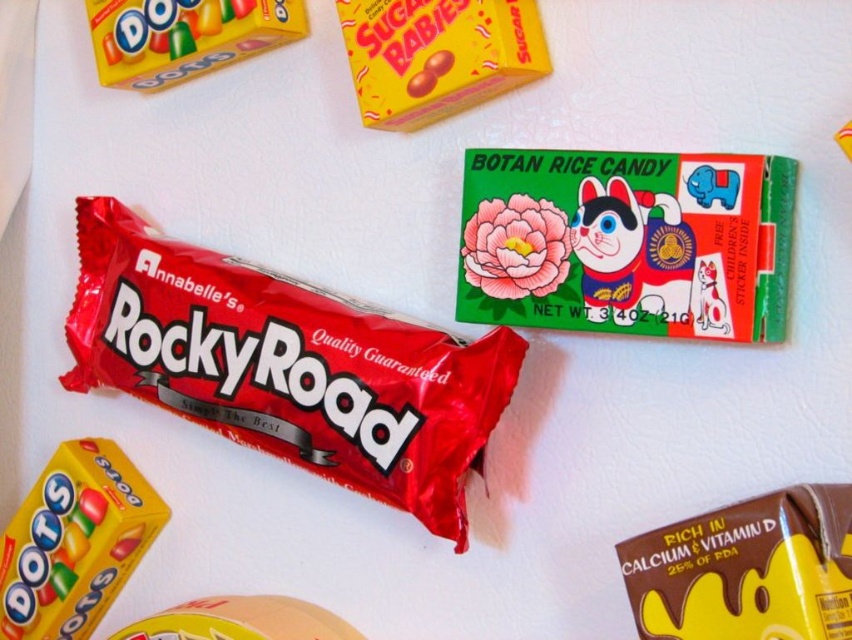
Question: Can you confirm if green paper botan rice candy at upper center is positioned to the right of yellow matte candy at lower left?

Choices:
 (A) yes
 (B) no

Answer: (A)

Question: Which of these objects is positioned farthest from the yellow matte candy at upper center?

Choices:
 (A) matte yellow plastic container at lower left
 (B) glossy yellow candy at upper left

Answer: (A)

Question: Estimate the real-world distances between objects in this image. Which object is closer to the shiny red chocolate bar at center?

Choices:
 (A) glossy yellow candy at upper left
 (B) chocolate bar at lower right
 (C) yellow matte candy at upper center
 (D) green paper botan rice candy at upper center

Answer: (D)

Question: Which point is closer to the camera taking this photo?

Choices:
 (A) (245, 636)
 (B) (597, 204)
 (C) (539, 51)

Answer: (B)

Question: Where is shiny red chocolate bar at center located in relation to chocolate bar at lower right in the image?

Choices:
 (A) above
 (B) below

Answer: (A)

Question: Where is shiny red chocolate bar at center located in relation to matte yellow plastic container at lower left in the image?

Choices:
 (A) below
 (B) above

Answer: (B)